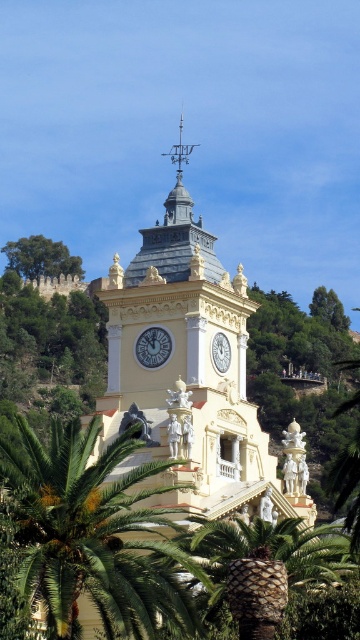
You are standing in front of the clock tower and notice two green leafy trees in the scene. Which tree is closer to you, the green leafy palm tree at lower center or the green leafy tree at upper left?

The green leafy palm tree at lower center is closer to you as it is positioned in front of the green leafy tree at upper left.

You are standing in front of the clock tower and notice the green leafy tree at upper left and the white glossy clock at upper center. Which object is closer to you?

The green leafy tree at upper left is closer to you because it is further to the viewer than the white glossy clock at upper center.